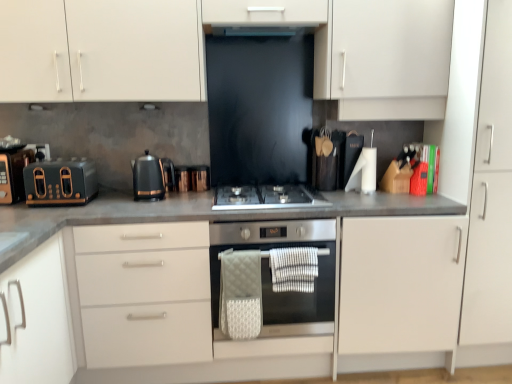
Where is `vacant space to the left of black metallic kettle at center, which appears as the second kitchen appliance when viewed from the left`? vacant space to the left of black metallic kettle at center, which appears as the second kitchen appliance when viewed from the left is located at coordinates (116, 202).